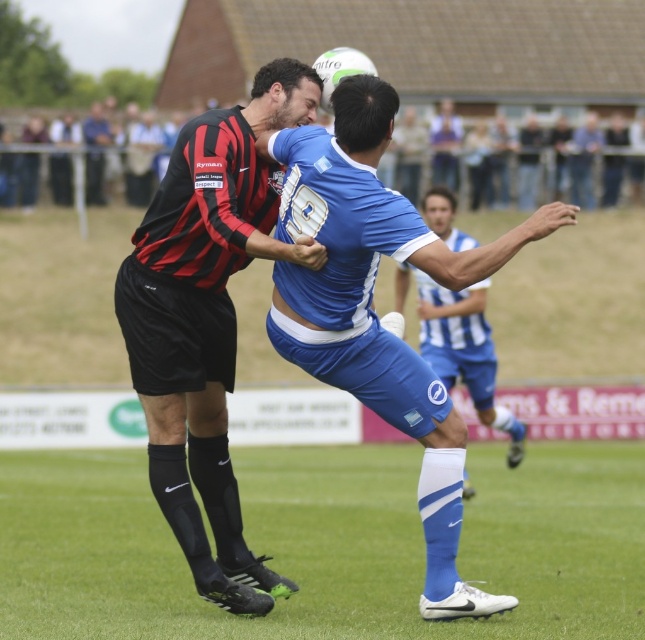
Question: Which of the following is the farthest from the observer?

Choices:
 (A) (86, 620)
 (B) (163, 372)

Answer: (A)

Question: Which object is farther from the camera taking this photo?

Choices:
 (A) blue matte jersey at center
 (B) black matte jersey at center
 (C) blue jersey at center
 (D) green grass at center

Answer: (C)

Question: Which is nearer to the green grass at center?

Choices:
 (A) black matte jersey at center
 (B) blue matte jersey at center
 (C) blue jersey at center

Answer: (C)

Question: Where is blue matte jersey at center located in relation to blue jersey at center in the image?

Choices:
 (A) right
 (B) left

Answer: (B)

Question: Is black matte jersey at center positioned at the back of blue jersey at center?

Choices:
 (A) yes
 (B) no

Answer: (B)

Question: Is green grass at center to the left of black matte jersey at center from the viewer's perspective?

Choices:
 (A) yes
 (B) no

Answer: (B)